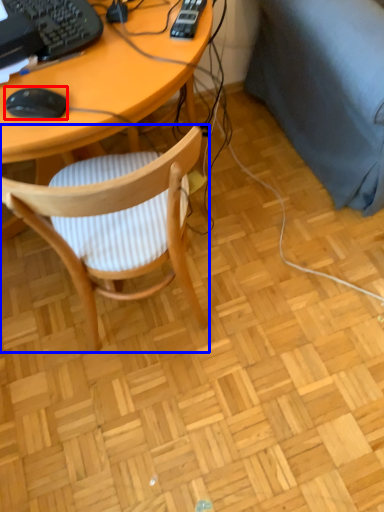
Question: Which object is further to the camera taking this photo, mouse (highlighted by a red box) or chair (highlighted by a blue box)?

Choices:
 (A) mouse
 (B) chair

Answer: (A)